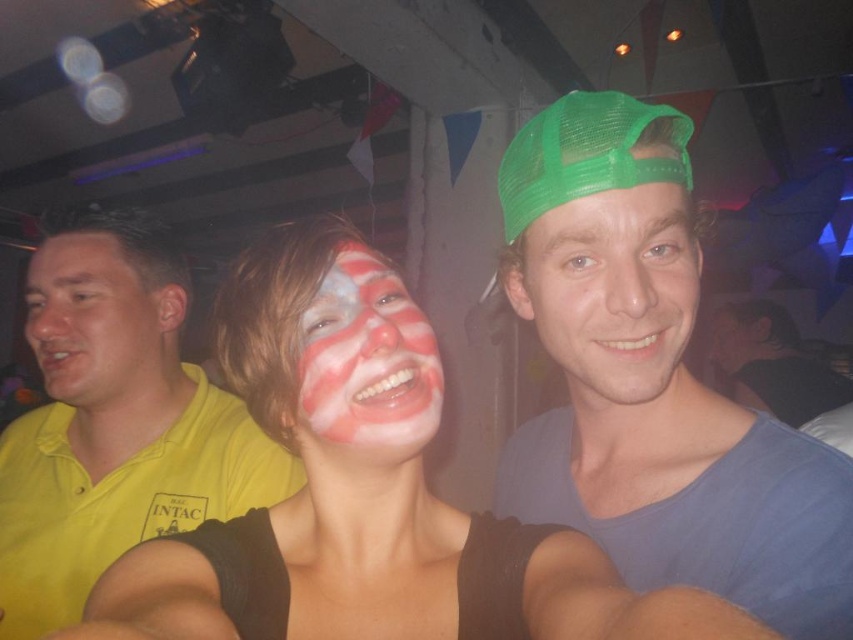
I want to click on painted face at center, so click(367, 360).

From the picture: Does painted face at center come behind matte blue shirt at center?

No, it is not.

Locate an element on the screen. This screenshot has width=853, height=640. painted face at center is located at coordinates (367, 360).

The height and width of the screenshot is (640, 853). In order to click on painted face at center in this screenshot , I will do `click(367, 360)`.

Which of these two, painted face at center or matte green cap at upper right, stands shorter?

painted face at center is shorter.

Who is positioned more to the right, painted face at center or matte green cap at upper right?

matte green cap at upper right

Which is in front, point (364, 360) or point (750, 348)?

Point (364, 360) is in front.

Identify the location of painted face at center. The width and height of the screenshot is (853, 640). (367, 360).

Does green mesh cap at upper right have a greater height compared to matte green cap at upper right?

Yes, green mesh cap at upper right is taller than matte green cap at upper right.

Does point (653, 540) lie behind point (729, 349)?

No.

Where is `green mesh cap at upper right`? The height and width of the screenshot is (640, 853). green mesh cap at upper right is located at coordinates (653, 381).